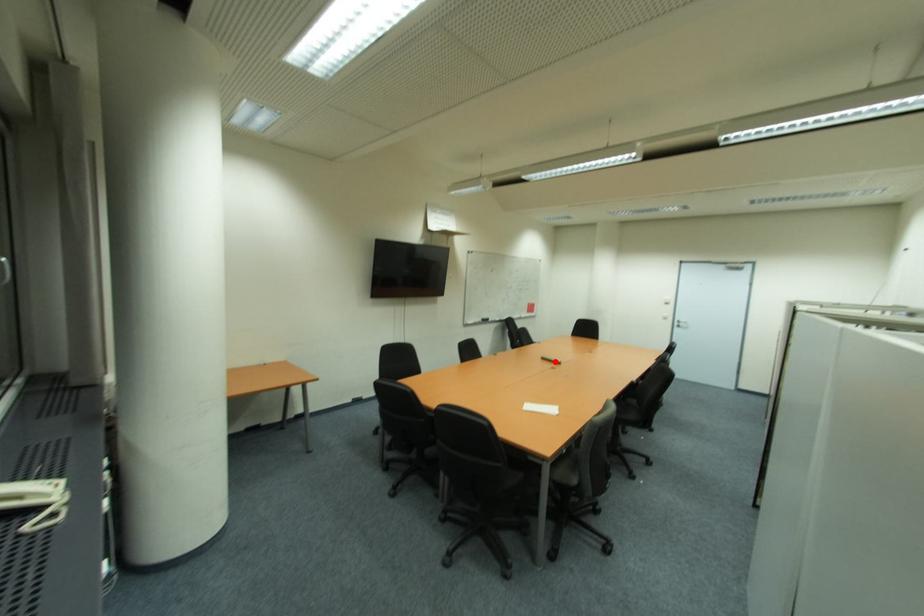
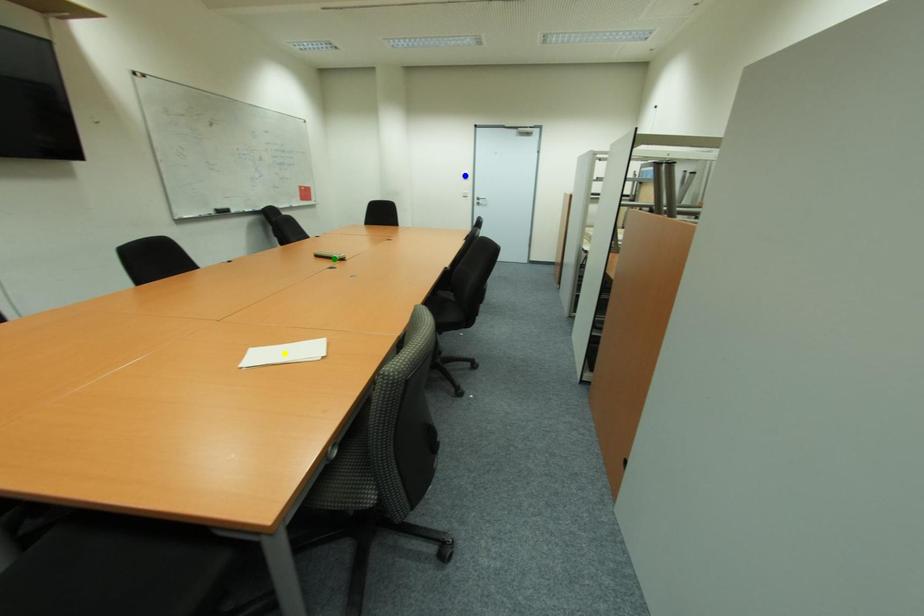
Question: I am providing you with two images of the same scene from different viewpoints. A red point is marked on the first image. You are given multiple points on the second image. Can you choose the point in image 2 that corresponds to the point in image 1?

Choices:
 (A) blue point
 (B) green point
 (C) yellow point

Answer: (B)